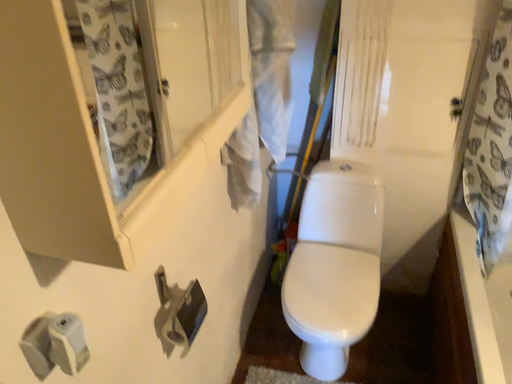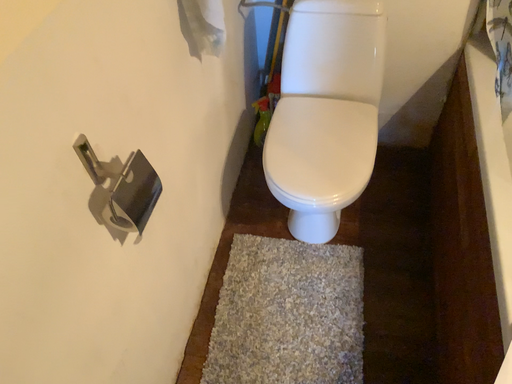
Question: How did the camera likely rotate when shooting the video?

Choices:
 (A) rotated upward
 (B) rotated downward

Answer: (B)